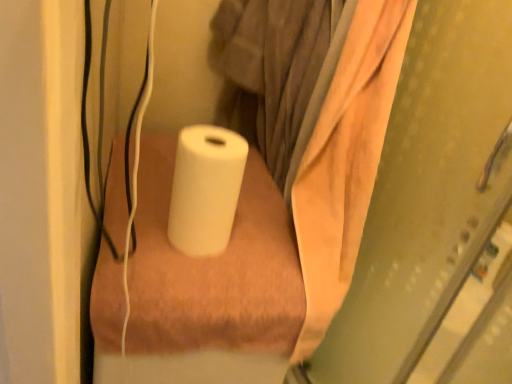
You are a GUI agent. You are given a task and a screenshot of the screen. Output one action in this format:
    pyautogui.click(x=<x>, y=<y>)
    Task: Click on the free point behind white matte paper towel at center
    This screenshot has width=512, height=384.
    Given the screenshot: What is the action you would take?
    pyautogui.click(x=237, y=197)